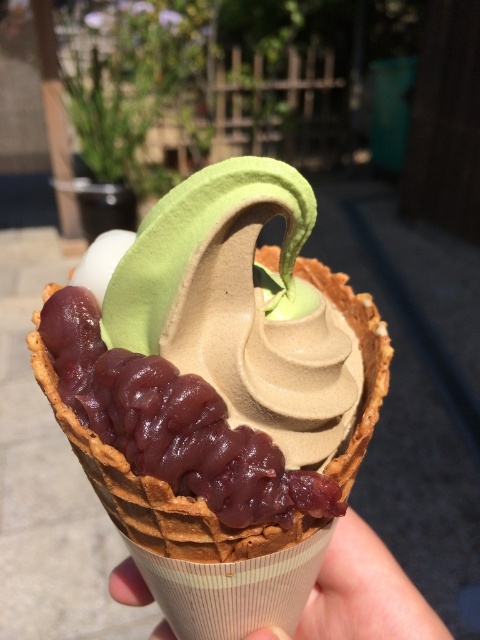
Question: Can you confirm if smooth chocolate ice cream cone at center is positioned above smooth beige cone at center?

Choices:
 (A) yes
 (B) no

Answer: (A)

Question: Among these objects, which one is farthest from the camera?

Choices:
 (A) smooth chocolate ice cream cone at center
 (B) smooth beige cone at center

Answer: (B)

Question: Does smooth chocolate ice cream cone at center appear on the left side of smooth beige cone at center?

Choices:
 (A) yes
 (B) no

Answer: (A)

Question: Which object appears closest to the camera in this image?

Choices:
 (A) smooth chocolate ice cream cone at center
 (B) smooth beige cone at center

Answer: (A)

Question: Is smooth chocolate ice cream cone at center behind smooth beige cone at center?

Choices:
 (A) yes
 (B) no

Answer: (B)

Question: Among these objects, which one is farthest from the camera?

Choices:
 (A) smooth beige cone at center
 (B) smooth chocolate ice cream cone at center

Answer: (A)